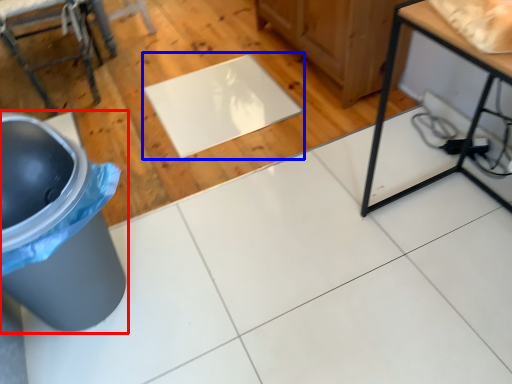
Question: Which object appears closest to the camera in this image, waste container (highlighted by a red box) or mat (highlighted by a blue box)?

Choices:
 (A) waste container
 (B) mat

Answer: (A)